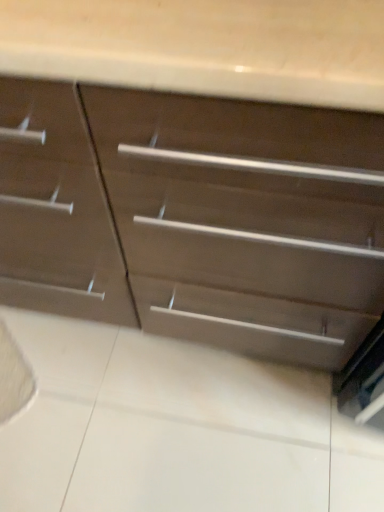
What do you see at coordinates (196, 216) in the screenshot? I see `matte brown drawer at center` at bounding box center [196, 216].

The height and width of the screenshot is (512, 384). I want to click on matte brown drawer at center, so click(196, 216).

Locate an element on the screen. The image size is (384, 512). matte brown drawer at center is located at coordinates (196, 216).